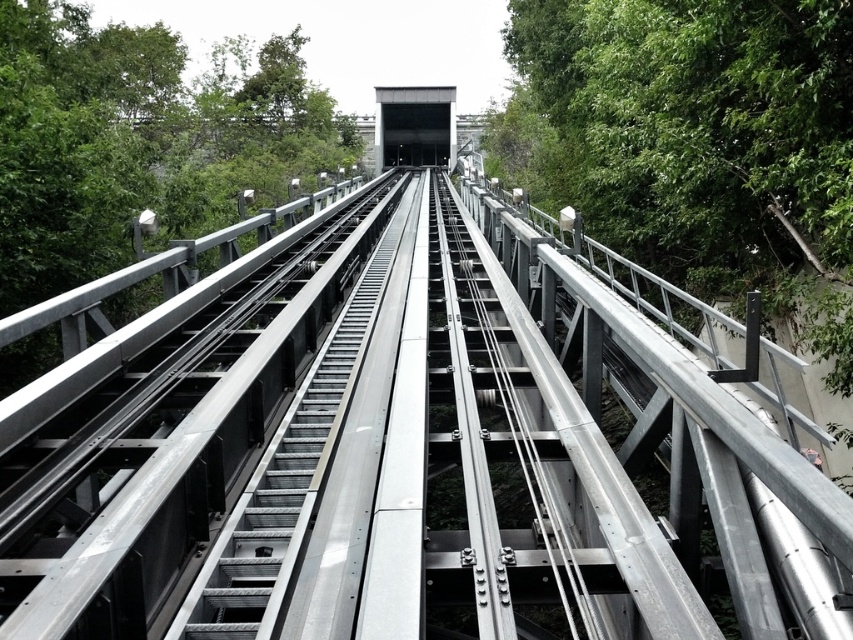
From the picture: Can you confirm if green leafy tree at right is smaller than metallic silver escalator at center?

No, green leafy tree at right is not smaller than metallic silver escalator at center.

Between green leafy tree at right and metallic silver escalator at center, which one is positioned higher?

green leafy tree at right is above.

Which is in front, point (598, 45) or point (341, 358)?

Point (341, 358) is more forward.

Identify the location of green leafy tree at right. (697, 147).

Measure the distance between point (602, 83) and camera.

Point (602, 83) is 36.57 feet away from camera.

Is green leafy tree at right smaller than green leafy tree at left?

Indeed, green leafy tree at right has a smaller size compared to green leafy tree at left.

Who is more forward, (776, 52) or (115, 161)?

Positioned in front is point (776, 52).

At what (x,y) coordinates should I click in order to perform the action: click on green leafy tree at right. Please return your answer as a coordinate pair (x, y). The height and width of the screenshot is (640, 853). Looking at the image, I should click on (697, 147).

Where is `green leafy tree at left`? green leafy tree at left is located at coordinates pyautogui.click(x=138, y=140).

Does green leafy tree at left have a larger size compared to metallic silver escalator at center?

Indeed, green leafy tree at left has a larger size compared to metallic silver escalator at center.

What are the coordinates of `green leafy tree at left` in the screenshot? It's located at [x=138, y=140].